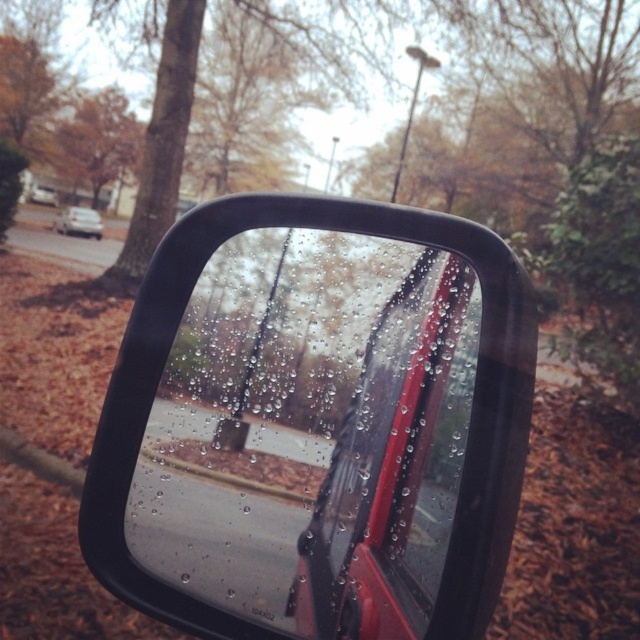
Question: Can you confirm if glossy plastic car mirror at center is positioned to the right of white matte sedan at left?

Choices:
 (A) yes
 (B) no

Answer: (A)

Question: Which object is closer to the camera taking this photo?

Choices:
 (A) white matte sedan at left
 (B) glossy plastic car mirror at center

Answer: (B)

Question: Does glossy plastic car mirror at center come behind white matte sedan at left?

Choices:
 (A) yes
 (B) no

Answer: (B)

Question: Which point is farther to the camera?

Choices:
 (A) (81, 211)
 (B) (332, 202)

Answer: (A)

Question: Can you confirm if glossy plastic car mirror at center is wider than white matte sedan at left?

Choices:
 (A) no
 (B) yes

Answer: (B)